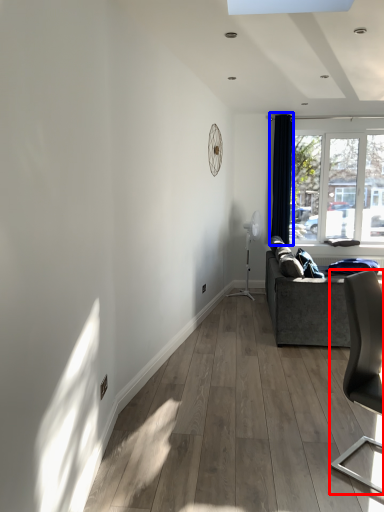
Question: Which of the following is the farthest to the observer, chair (highlighted by a red box) or curtain (highlighted by a blue box)?

Choices:
 (A) chair
 (B) curtain

Answer: (B)